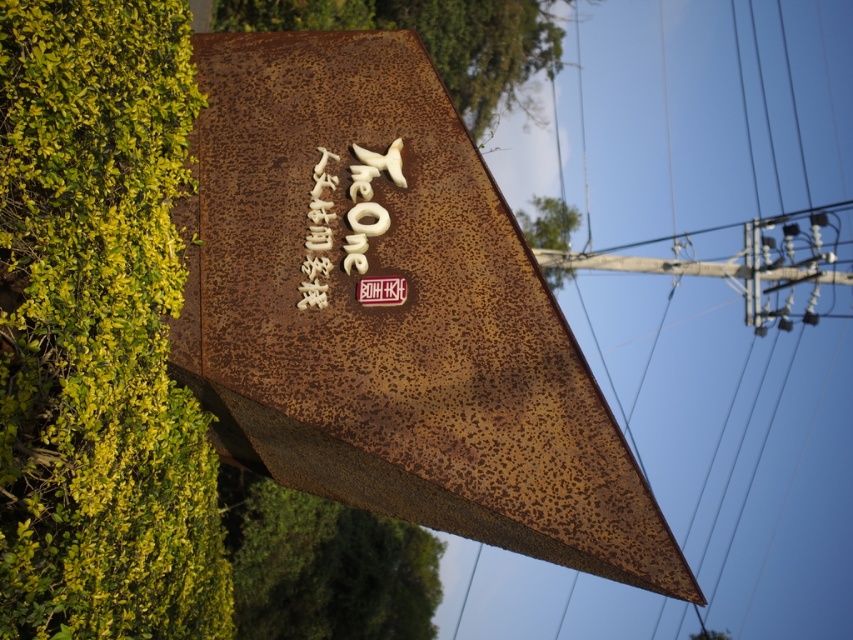
Is point (74, 621) farther from camera compared to point (283, 620)?

No, (74, 621) is closer to viewer.

Between green leafy hedge at left and green leafy hedge at lower left, which one has more height?

Standing taller between the two is green leafy hedge at left.

Describe the element at coordinates (97, 332) in the screenshot. I see `green leafy hedge at left` at that location.

I want to click on green leafy hedge at left, so click(x=97, y=332).

Which of these two, rusty metal sign at center or green leafy hedge at left, stands taller?

green leafy hedge at left is taller.

Is point (392, 404) positioned before point (97, 566)?

No, it is not.

Image resolution: width=853 pixels, height=640 pixels. What are the coordinates of `rusty metal sign at center` in the screenshot? It's located at (393, 317).

Which is above, rusty metal sign at center or green leafy hedge at lower left?

Positioned higher is rusty metal sign at center.

Measure the distance between point (509, 291) and camera.

Point (509, 291) is 4.54 meters away from camera.

Is point (380, 45) positioned after point (383, 609)?

No, (380, 45) is closer to viewer.

You are a GUI agent. You are given a task and a screenshot of the screen. Output one action in this format:
    pyautogui.click(x=<x>, y=<y>)
    Task: Click on the rusty metal sign at center
    
    Given the screenshot: What is the action you would take?
    pyautogui.click(x=393, y=317)